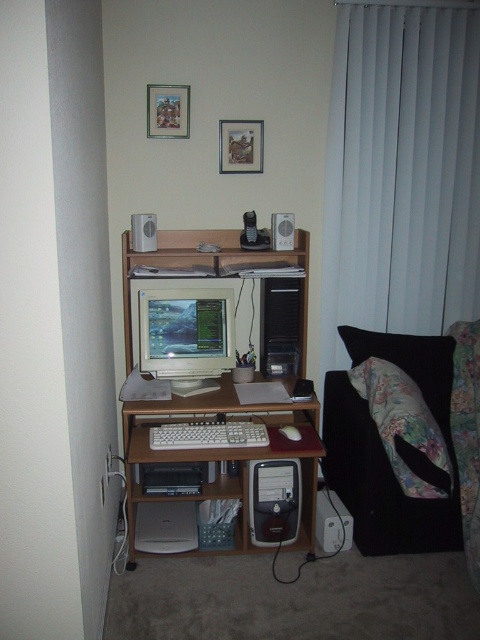
Is matte silver monitor at center closer to camera compared to matte plastic speaker at upper center?

Yes, it is in front of matte plastic speaker at upper center.

Does matte silver monitor at center have a larger size compared to matte plastic speaker at upper center?

Indeed, matte silver monitor at center has a larger size compared to matte plastic speaker at upper center.

I want to click on matte silver monitor at center, so click(x=187, y=337).

Image resolution: width=480 pixels, height=640 pixels. Identify the location of matte silver monitor at center. (187, 337).

Between white vertical blinds at right and matte wood computer desk at center, which one appears on the right side from the viewer's perspective?

white vertical blinds at right

Consider the image. Measure the distance between white vertical blinds at right and camera.

white vertical blinds at right and camera are 2.68 meters apart.

Describe the element at coordinates (402, 173) in the screenshot. I see `white vertical blinds at right` at that location.

The image size is (480, 640). I want to click on white vertical blinds at right, so click(402, 173).

Which is behind, point (192, 356) or point (290, 436)?

Point (192, 356)

Does matte silver monitor at center have a larger size compared to white matte mouse at center?

Yes.

Image resolution: width=480 pixels, height=640 pixels. I want to click on matte silver monitor at center, so 187,337.